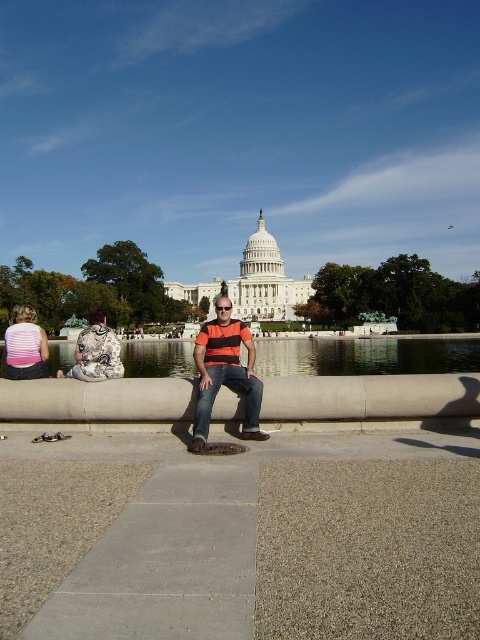
Is point (292, 360) in front of point (205, 352)?

No, (292, 360) is behind (205, 352).

Between point (175, 353) and point (226, 324), which one is positioned in front?

Point (226, 324) is in front.

Find the location of `clear glass water at center`. clear glass water at center is located at coordinates (365, 355).